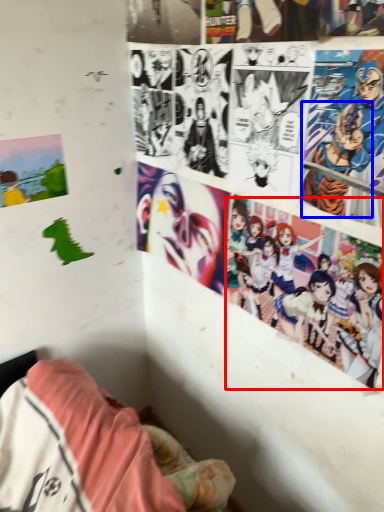
Question: Which object appears farthest to the camera in this image, person (highlighted by a red box) or person (highlighted by a blue box)?

Choices:
 (A) person
 (B) person

Answer: (A)